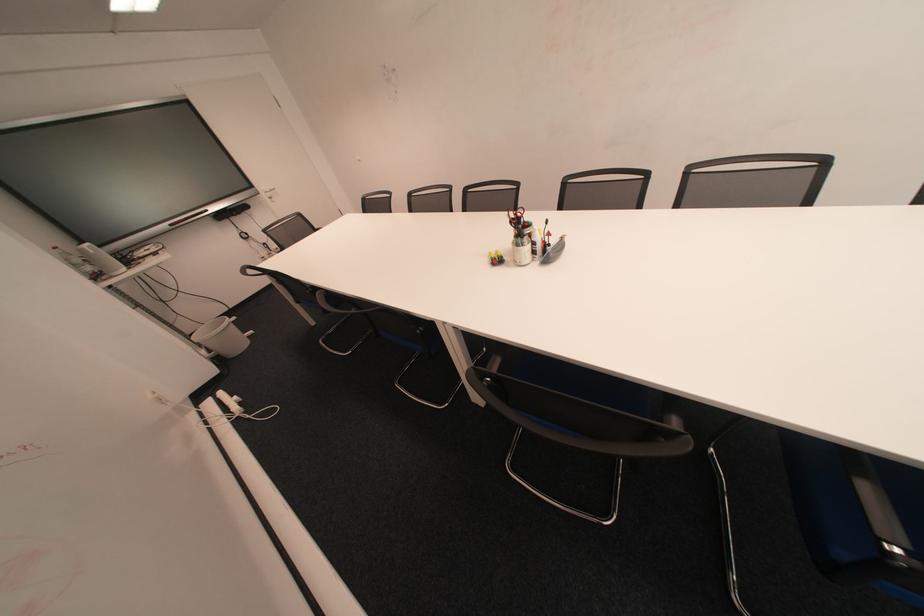
The image size is (924, 616). What are the coordinates of `white pen holder` in the screenshot? It's located at (222, 337).